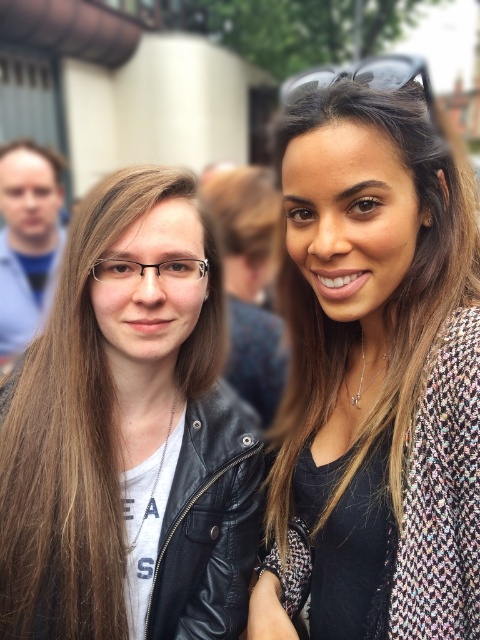
Question: Which point is farther to the camera?

Choices:
 (A) black plastic goggles at upper center
 (B) black leather jacket at left

Answer: (B)

Question: In this image, where is black leather jacket at left located relative to multicolored tweed jacket at upper right?

Choices:
 (A) above
 (B) below

Answer: (B)

Question: Which point is farther to the camera?

Choices:
 (A) multicolored tweed jacket at upper right
 (B) black leather jacket at left
 (C) black plastic goggles at upper center
 (D) matte blue shirt at left

Answer: (D)

Question: Which point is farther to the camera?

Choices:
 (A) black plastic goggles at upper center
 (B) matte blue shirt at left

Answer: (B)

Question: Can you confirm if black leather jacket at left is thinner than black plastic goggles at upper center?

Choices:
 (A) no
 (B) yes

Answer: (B)

Question: Is black leather jacket at left above black plastic goggles at upper center?

Choices:
 (A) yes
 (B) no

Answer: (B)